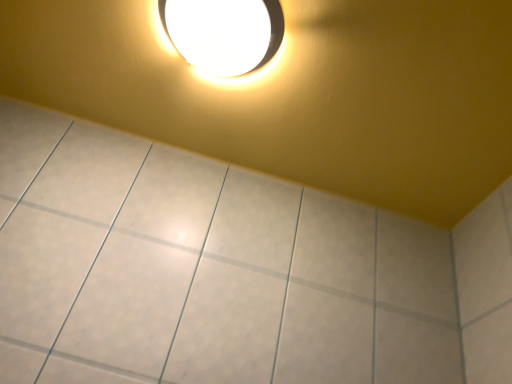
At what (x,y) coordinates should I click in order to perform the action: click on matte gold lamp at upper center. Please return your answer as a coordinate pair (x, y). The height and width of the screenshot is (384, 512). Looking at the image, I should click on (224, 33).

Describe the element at coordinates (224, 33) in the screenshot. I see `matte gold lamp at upper center` at that location.

Locate an element on the screen. matte gold lamp at upper center is located at coordinates pyautogui.click(x=224, y=33).